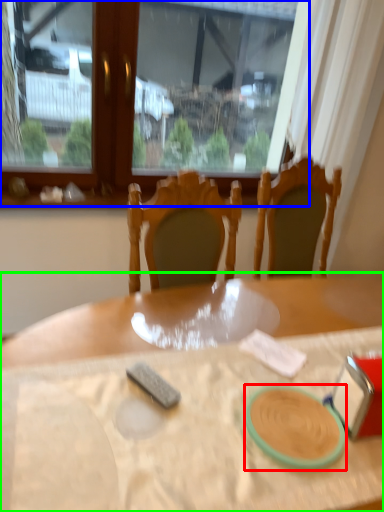
Question: Based on their relative distances, which object is farther from tableware (highlighted by a red box)? Choose from window (highlighted by a blue box) and table (highlighted by a green box).

Choices:
 (A) window
 (B) table

Answer: (A)